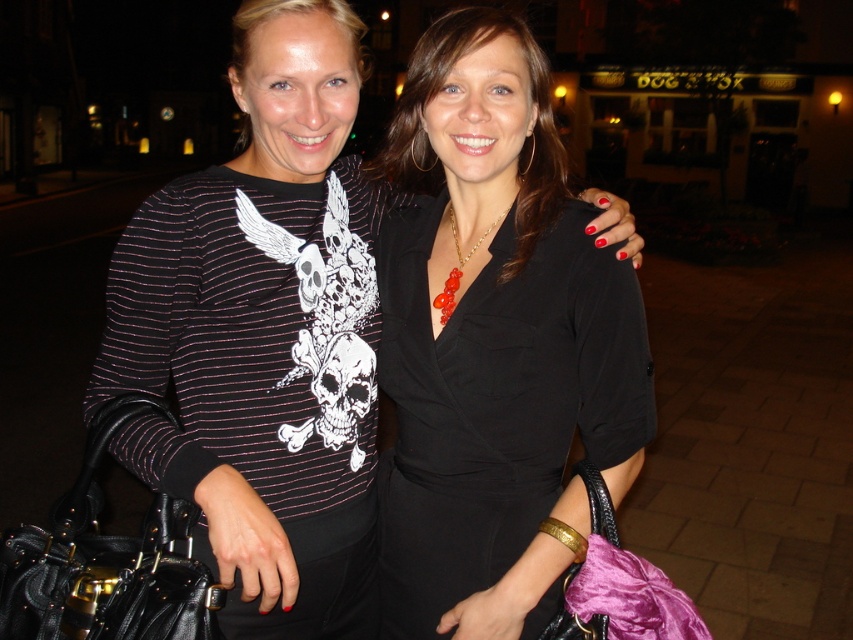
Looking at this image, you are a fashion stylist analyzing the outfits of two women in the image. The women are holding a black leather handbag at left and a velvet purple bag at lower right. Which handbag is wider?

The black leather handbag at left is wider than the velvet purple bag at lower right.

You are a photographer setting up for a photoshoot and need to ensure proper lighting. The subject is wearing the matte black dress at center and holding the black leather handbag at left. Given that the lighting equipment is placed 20 centimeters away from the dress, will the handbag be within the light coverage area?

The matte black dress at center is 20.51 centimeters from the black leather handbag at left. Since the lighting equipment is placed 20 centimeters away from the dress, the handbag is slightly beyond the light coverage area by 0.51 centimeters.

In the scene shown: Based on the scene description, where is the matte black dress at center located in terms of coordinates?

The matte black dress at center is located at point (263, 337).